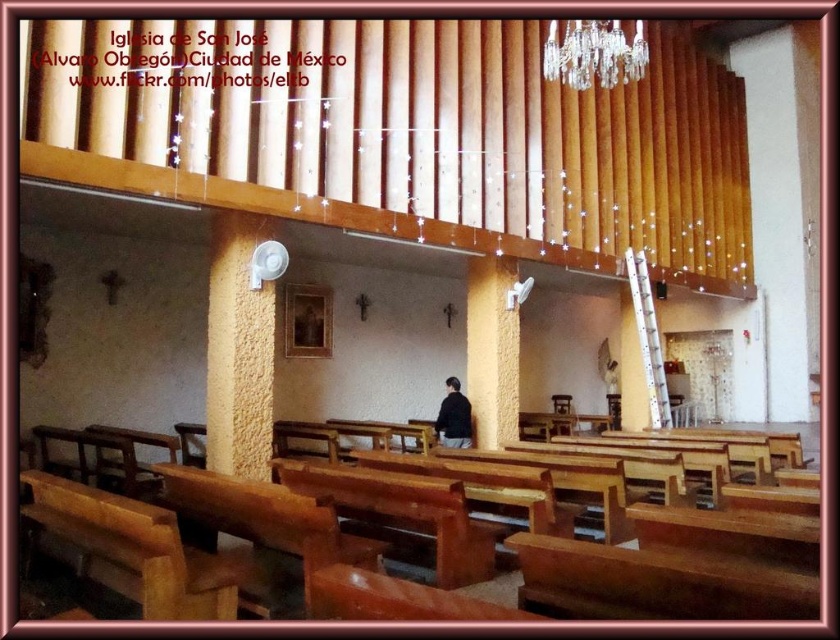
Who is more forward, (669, 424) or (450, 387)?

Point (450, 387) is more forward.

Based on the photo, which is more to the right, white metallic ladder at right or black matte jacket at center?

From the viewer's perspective, white metallic ladder at right appears more on the right side.

Where is `white metallic ladder at right`? This screenshot has width=840, height=640. white metallic ladder at right is located at coordinates tap(648, 337).

Identify the location of white metallic ladder at right. (648, 337).

Which is below, wooden church bench at center or white metallic ladder at right?

wooden church bench at center is lower down.

Can you confirm if wooden church bench at center is smaller than white metallic ladder at right?

Incorrect, wooden church bench at center is not smaller in size than white metallic ladder at right.

Which is behind, point (497, 593) or point (633, 307)?

The point (633, 307) is more distant.

Where is `wooden church bench at center`? The image size is (840, 640). wooden church bench at center is located at coordinates (785, 432).

Does point (626, 74) lie behind point (633, 291)?

No, it is not.

In the scene shown: Is clear crystal chandelier at upper center smaller than white metallic ladder at right?

Indeed, clear crystal chandelier at upper center has a smaller size compared to white metallic ladder at right.

Image resolution: width=840 pixels, height=640 pixels. I want to click on clear crystal chandelier at upper center, so click(x=592, y=52).

This screenshot has height=640, width=840. Identify the location of clear crystal chandelier at upper center. (592, 52).